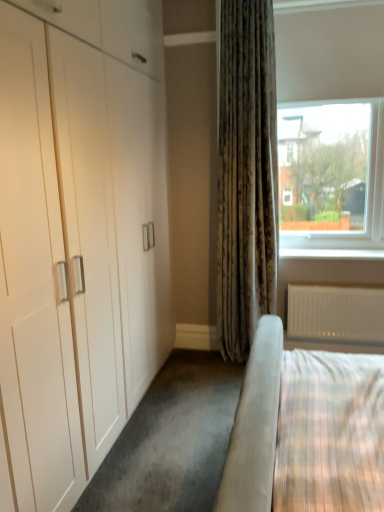
Locate an element on the screen. This screenshot has height=512, width=384. vacant area on top of white textured radiator at lower right (from a real-world perspective) is located at coordinates (342, 284).